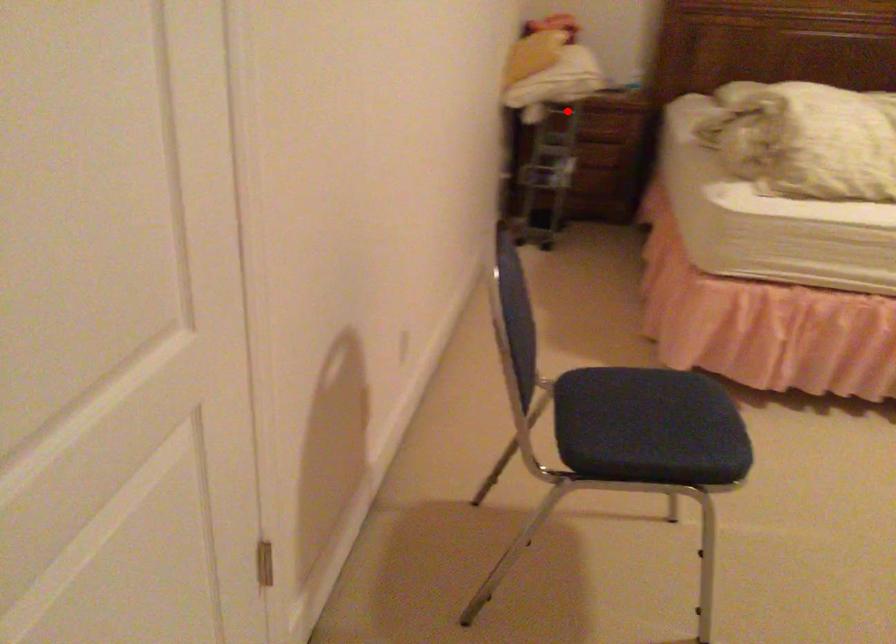
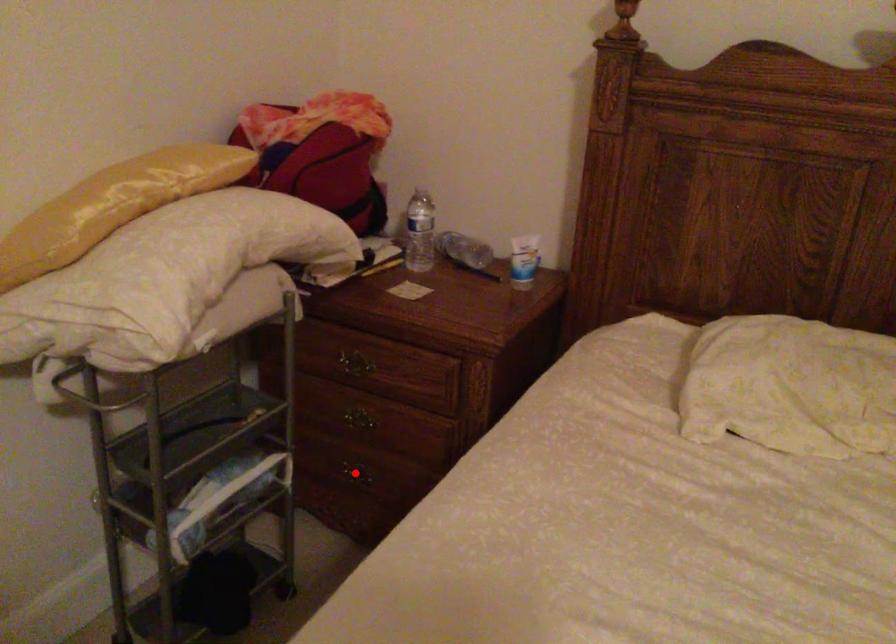
I am providing you with two images of the same scene from different viewpoints. A red point is marked on the first image and another point is marked on the second image. Does the point marked in image1 correspond to the same location as the one in image2?

No